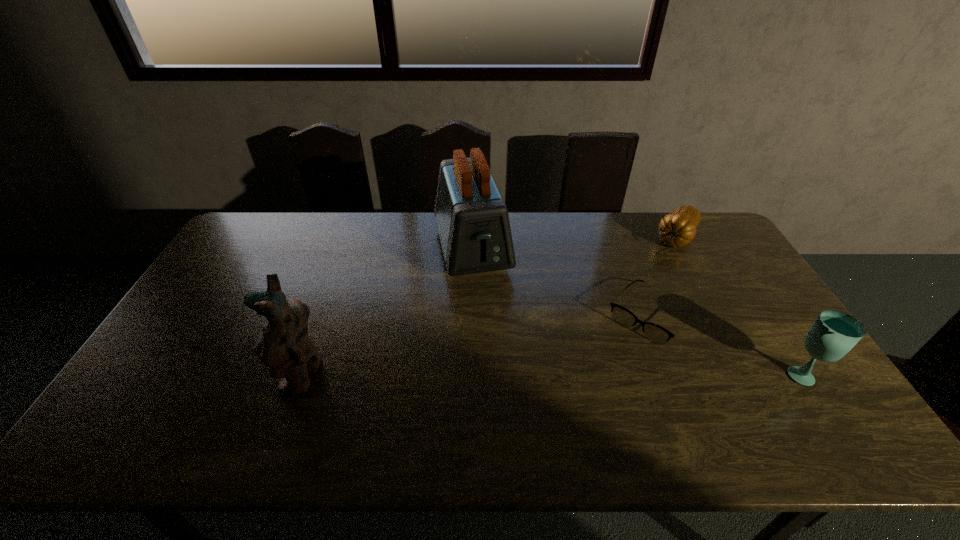
The image size is (960, 540). Find the location of `free space between the leftmost object and the shortest object`. free space between the leftmost object and the shortest object is located at coordinates (476, 346).

You are a GUI agent. You are given a task and a screenshot of the screen. Output one action in this format:
    pyautogui.click(x=<x>, y=<y>)
    Task: Click on the free space between the leftmost object and the second shortest object
    
    Given the screenshot: What is the action you would take?
    pyautogui.click(x=490, y=306)

Find the location of `vacant area that lies between the shortest object and the third shortest object`. vacant area that lies between the shortest object and the third shortest object is located at coordinates (727, 345).

Point out which object is positioned as the second nearest to the spectacles. Please provide its 2D coordinates. Your answer should be formatted as a tuple, i.e. [(x, y)], where the tuple contains the x and y coordinates of a point satisfying the conditions above.

[(834, 333)]

This screenshot has width=960, height=540. What are the coordinates of `object identified as the fourth closest to the rightmost object` in the screenshot? It's located at (284, 345).

Identify the location of vacant space that satisfies the following two spatial constraints: 1. on the front side of the fourth tallest object; 2. on the right side of the third tallest object. The height and width of the screenshot is (540, 960). (752, 374).

Where is `blank area in the image that satisfies the following two spatial constraints: 1. on the front side of the gourd; 2. on the left side of the glass`? This screenshot has width=960, height=540. blank area in the image that satisfies the following two spatial constraints: 1. on the front side of the gourd; 2. on the left side of the glass is located at coordinates (752, 374).

This screenshot has width=960, height=540. I want to click on free space that satisfies the following two spatial constraints: 1. on the front side of the toaster; 2. on the left side of the glass, so click(x=469, y=374).